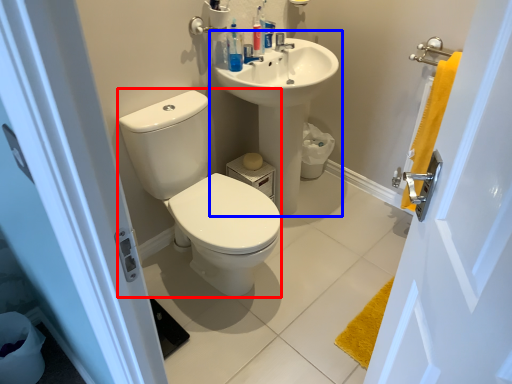
Question: Which object appears closest to the camera in this image, sit (highlighted by a red box) or sink (highlighted by a blue box)?

Choices:
 (A) sit
 (B) sink

Answer: (A)